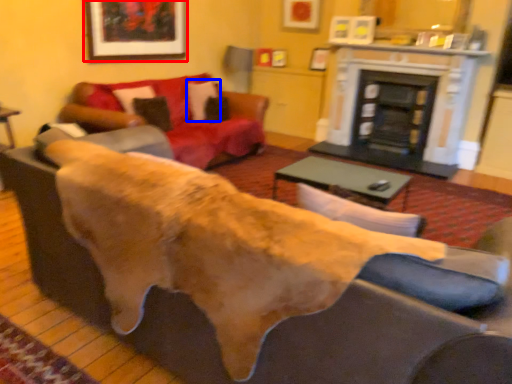
Question: Which of the following is the farthest to the observer, picture frame (highlighted by a red box) or pillow (highlighted by a blue box)?

Choices:
 (A) picture frame
 (B) pillow

Answer: (B)